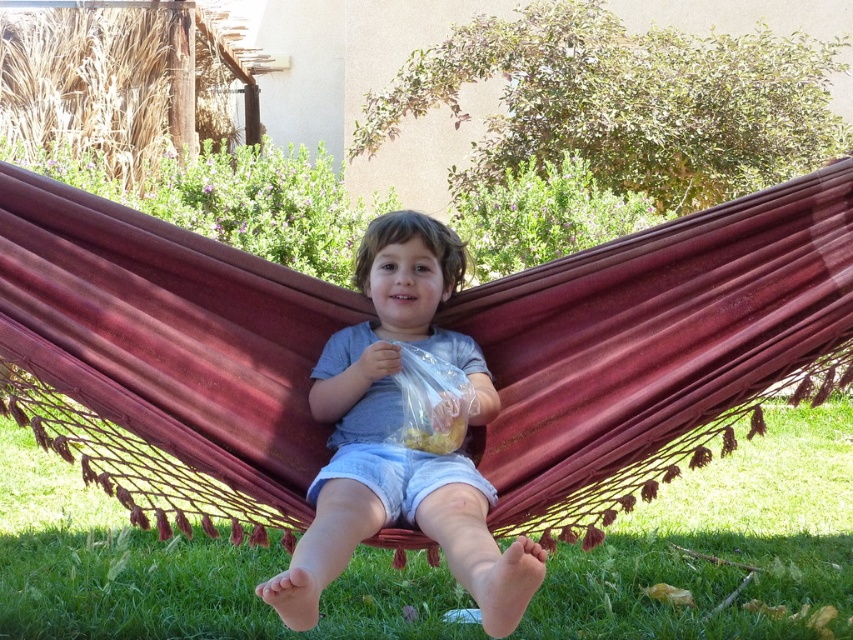
You are planning to hang a new hammock in your backyard. The existing burgundy fabric hammock at center is already installed at coordinates point 0.547, 0.769. If you want to place a new hammock 1 meter to the north of the existing one, what coordinates should you aim for?

The new hammock should be placed at coordinates point (654, 349) plus 1 meter north. However, without knowing the scale of the coordinate system, it is impossible to determine the exact numerical coordinates for the new position. Please consult a map or survey the area to accurately measure the distance north.

You are standing in a backyard and see the burgundy fabric hammock at center. If you want to reach it without moving your feet, can you touch it with your outstretched hand?

The burgundy fabric hammock at center is 2.35 meters from viewer, so no, you cannot touch it with your outstretched hand since the distance is greater than an average person can reach without moving.

You are a photographer trying to capture the burgundy fabric hammock at center and the matte gray shirt at center in a single shot. Since the camera can only focus on one object at a time, which object should you focus on to ensure the other remains in the background?

You should focus on the burgundy fabric hammock at center because it is positioned over the matte gray shirt at center, making the shirt appear in the background.